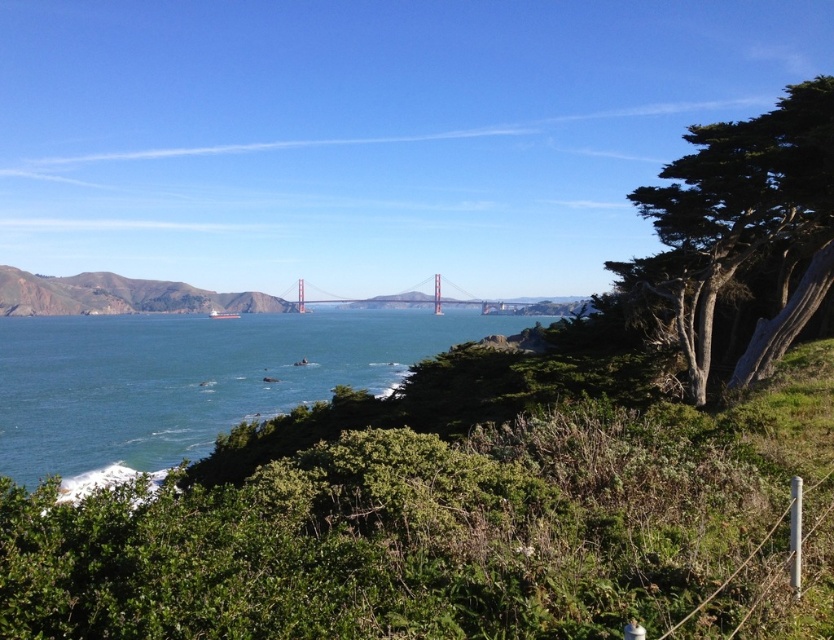
Between brown rocky hill at left and painted steel bridge at center, which one has more height?

brown rocky hill at left is taller.

How much distance is there between brown rocky hill at left and painted steel bridge at center?

A distance of 333.01 feet exists between brown rocky hill at left and painted steel bridge at center.

Between point (149, 285) and point (516, 307), which one is positioned behind?

Point (149, 285)

I want to click on brown rocky hill at left, so click(x=119, y=296).

Who is lower down, blue water at center or brown rocky hill at left?

blue water at center is below.

Can you confirm if blue water at center is positioned below brown rocky hill at left?

Yes.

Locate an element on the screen. The height and width of the screenshot is (640, 834). blue water at center is located at coordinates (191, 380).

Between blue water at center and painted steel bridge at center, which one has more height?

painted steel bridge at center

Is point (127, 371) in front of point (428, 301)?

Yes, it is.

In order to click on blue water at center in this screenshot , I will do `click(191, 380)`.